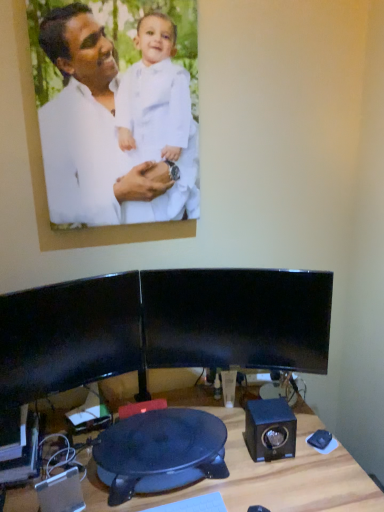
Find the location of a particular element. Image resolution: width=384 pixels, height=512 pixels. blank space above black plastic swivel chair at center (from a real-world perspective) is located at coordinates (160, 436).